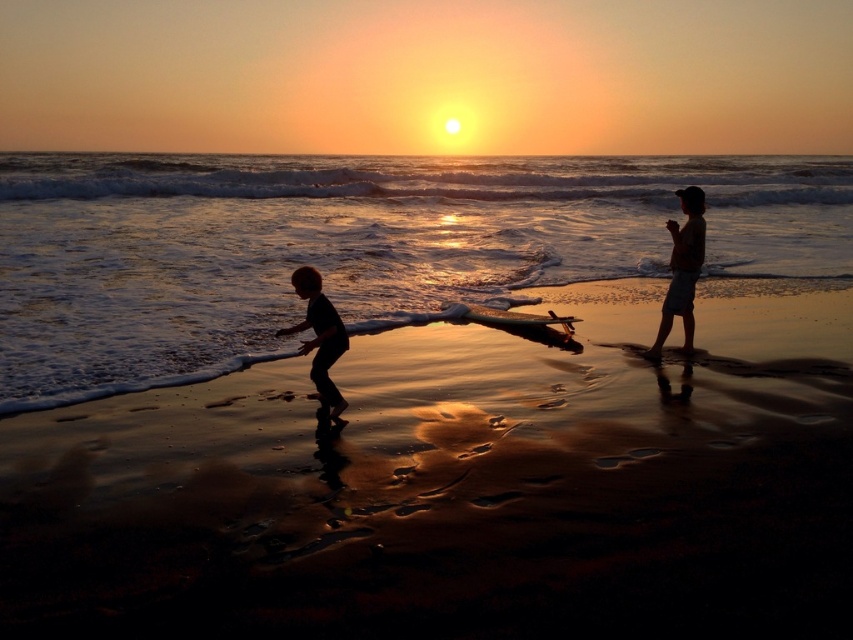
Does shiny sand at lower center have a smaller size compared to reflective wet sand at lower center?

Yes, shiny sand at lower center is smaller than reflective wet sand at lower center.

Can you confirm if shiny sand at lower center is shorter than reflective wet sand at lower center?

Yes, shiny sand at lower center is shorter than reflective wet sand at lower center.

What are the coordinates of `shiny sand at lower center` in the screenshot? It's located at (456, 488).

Who is higher up, reflective wet sand at lower center or silhouette sand at right?

Positioned higher is reflective wet sand at lower center.

Between point (136, 314) and point (666, 292), which one is positioned in front?

Point (666, 292) is in front.

Does point (799, 262) come behind point (682, 253)?

That is True.

Where is `reflective wet sand at lower center`? Image resolution: width=853 pixels, height=640 pixels. reflective wet sand at lower center is located at coordinates (350, 246).

Can you confirm if shiny sand at lower center is wider than silhouette child at lower left?

No.

What are the coordinates of `shiny sand at lower center` in the screenshot? It's located at (456, 488).

Who is more distant from viewer, (527,577) or (318,346)?

Positioned behind is point (318,346).

At what (x,y) coordinates should I click in order to perform the action: click on shiny sand at lower center. Please return your answer as a coordinate pair (x, y). This screenshot has height=640, width=853. Looking at the image, I should click on (456, 488).